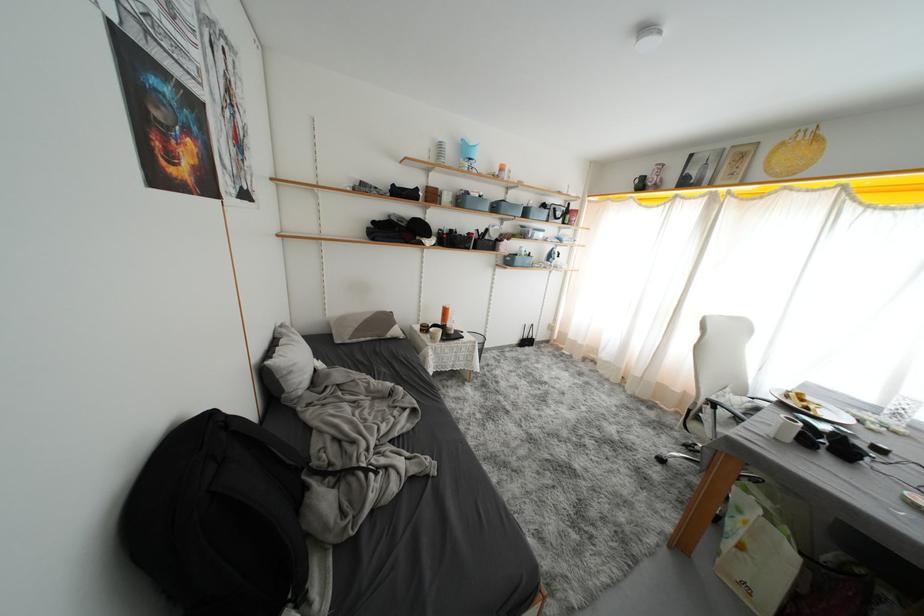
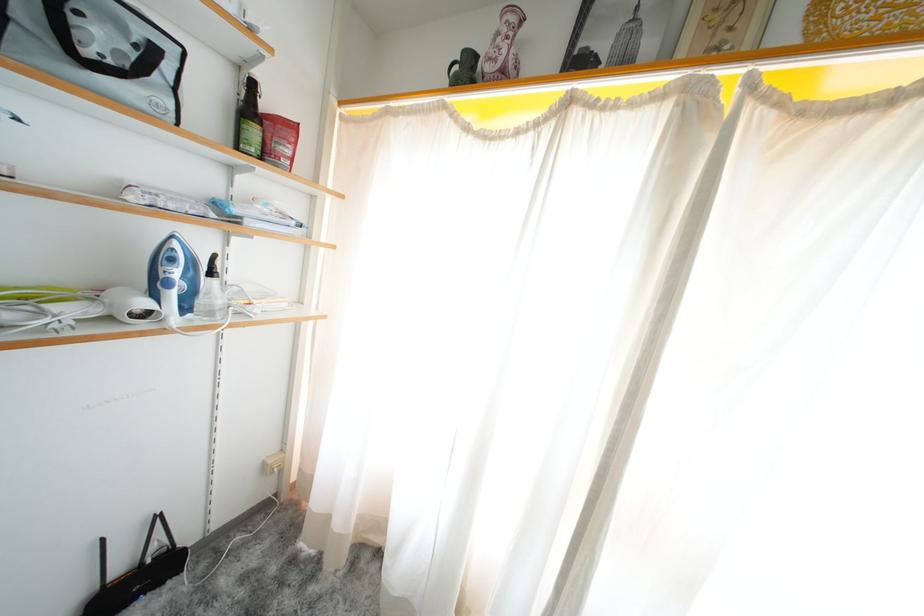
Locate, in the second image, the point that corresponds to pixel 532 346 in the first image.

(143, 586)